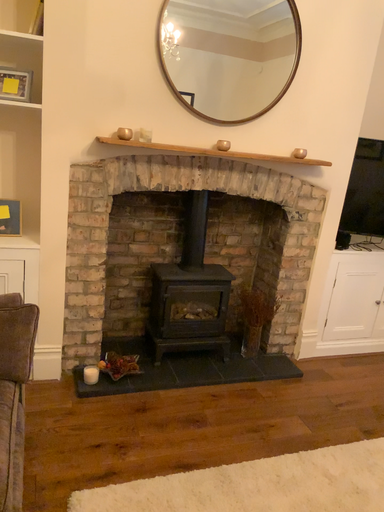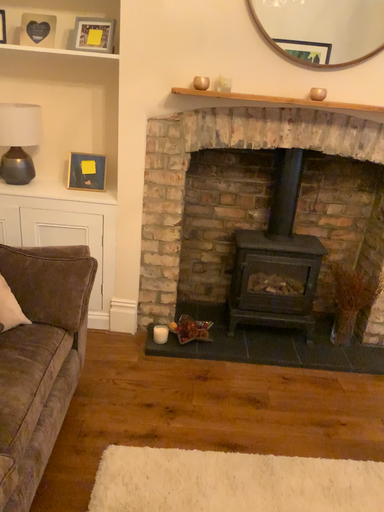
Question: Which way did the camera rotate in the video?

Choices:
 (A) rotated left
 (B) rotated right

Answer: (A)